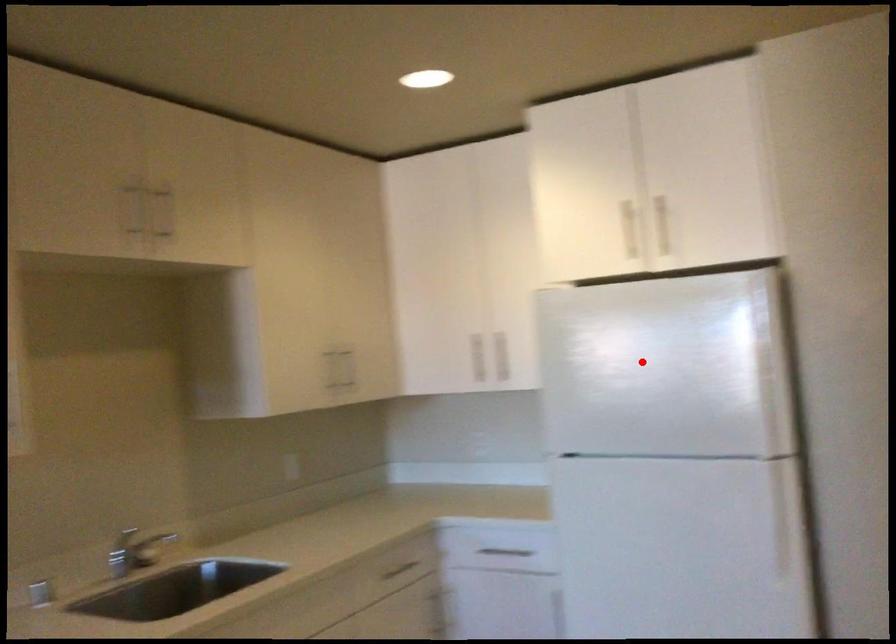
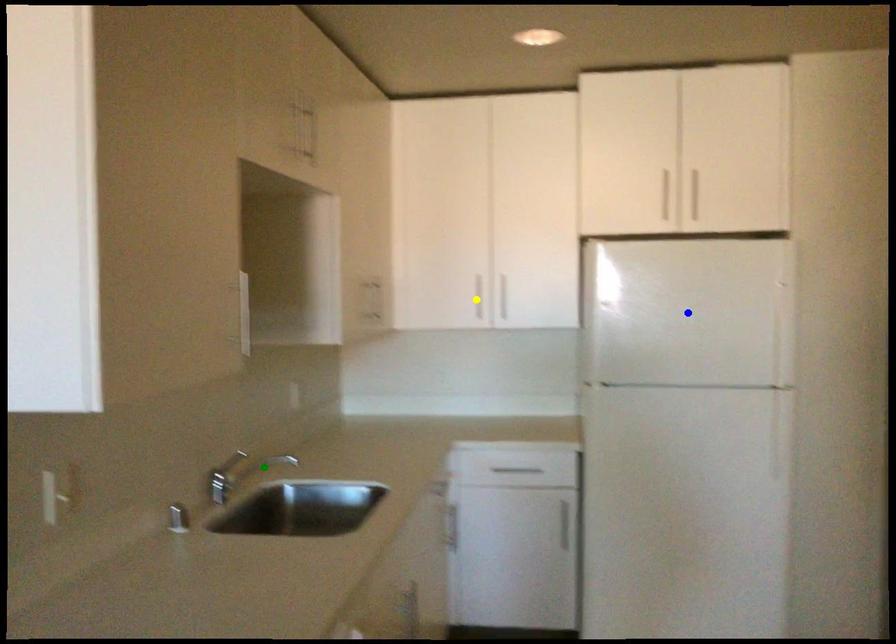
Question: I am providing you with two images of the same scene from different viewpoints. A red point is marked on the first image. You are given multiple points on the second image. In image 2, which mark is for the same physical point as the one in image 1?

Choices:
 (A) blue point
 (B) yellow point
 (C) green point

Answer: (A)